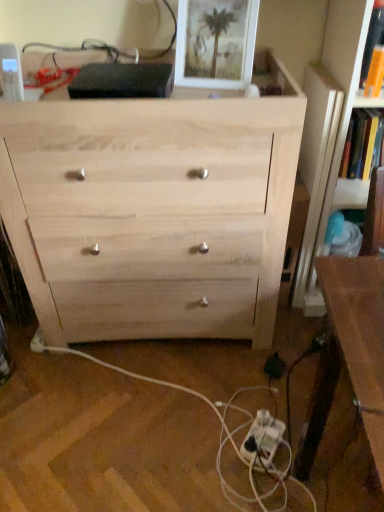
Where is `vacant space that's between white plastic extension cord at lower center and black plastic electric outlet at lower right`? This screenshot has height=512, width=384. vacant space that's between white plastic extension cord at lower center and black plastic electric outlet at lower right is located at coordinates (269, 400).